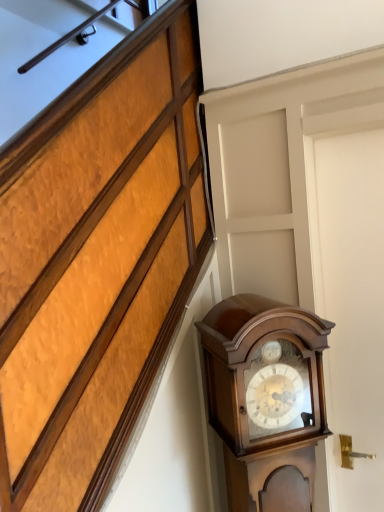
Question: Looking at the image, does white matte door at right seem bigger or smaller compared to polished wood grandfather clock at right?

Choices:
 (A) big
 (B) small

Answer: (B)

Question: Considering the positions of point (309, 185) and point (256, 315), is point (309, 185) closer or farther from the camera than point (256, 315)?

Choices:
 (A) farther
 (B) closer

Answer: (A)

Question: Based on their positions, is white matte door at right located to the left or right of polished wood grandfather clock at right?

Choices:
 (A) left
 (B) right

Answer: (B)

Question: Based on their sizes in the image, would you say polished wood grandfather clock at right is bigger or smaller than white matte door at right?

Choices:
 (A) big
 (B) small

Answer: (A)

Question: Is polished wood grandfather clock at right inside or outside of white matte door at right?

Choices:
 (A) outside
 (B) inside

Answer: (A)

Question: Looking at their shapes, would you say polished wood grandfather clock at right is wider or thinner than white matte door at right?

Choices:
 (A) wide
 (B) thin

Answer: (A)

Question: From the image's perspective, is polished wood grandfather clock at right positioned above or below white matte door at right?

Choices:
 (A) below
 (B) above

Answer: (A)